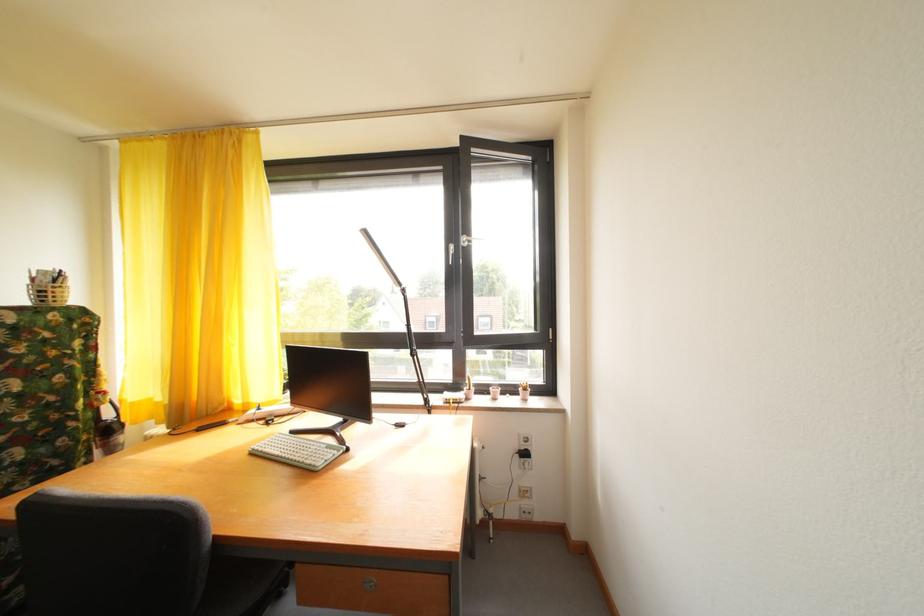
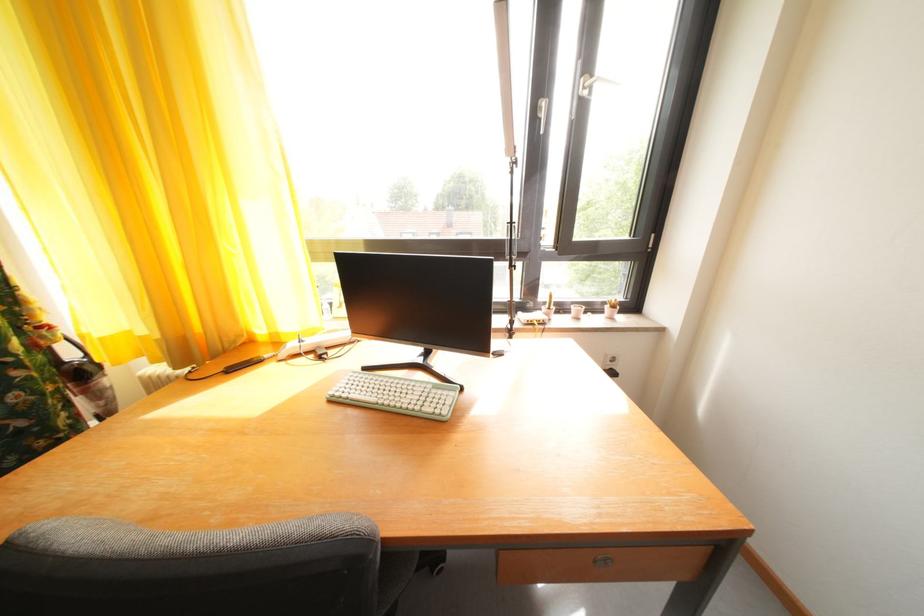
In a continuous first-person perspective shot, in which direction is the camera moving?

The cameraman moved toward left, forward.